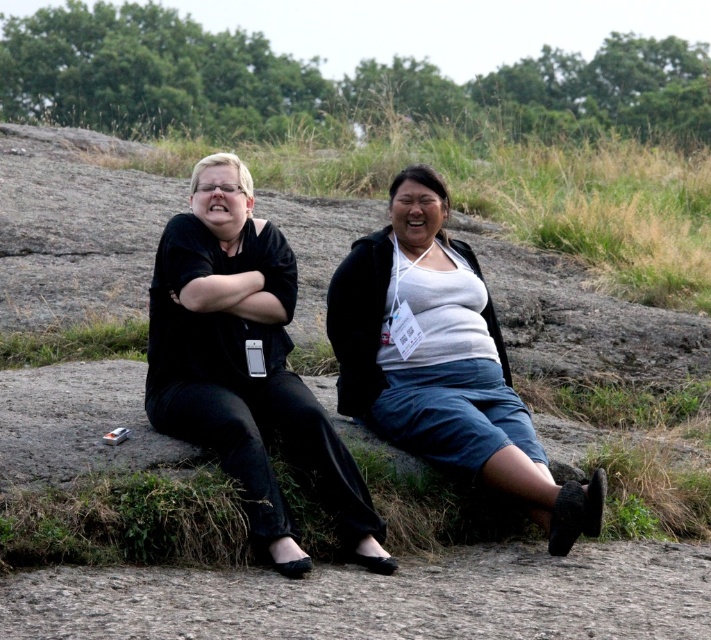
Who is more distant from viewer, (x=166, y=275) or (x=540, y=480)?

The point (x=166, y=275) is more distant.

Who is taller, black matte/black pants at left or white matte tank top at center?

black matte/black pants at left is taller.

The height and width of the screenshot is (640, 711). I want to click on black matte/black pants at left, so click(245, 365).